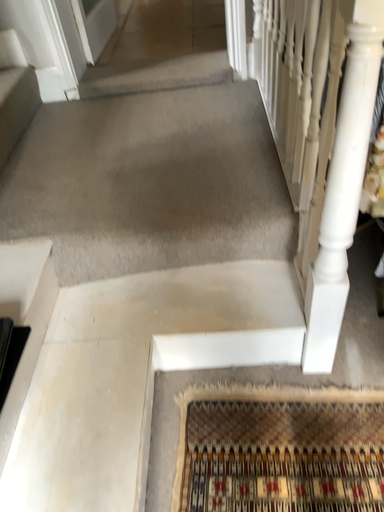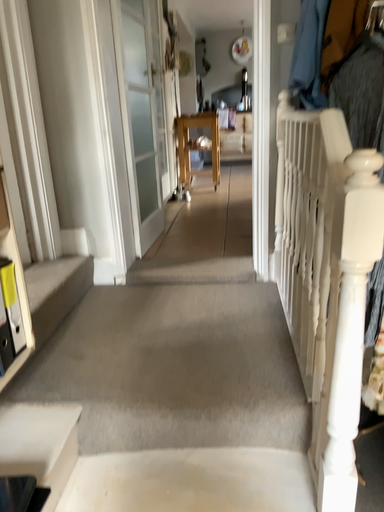
Question: How did the camera likely rotate when shooting the video?

Choices:
 (A) rotated upward
 (B) rotated downward

Answer: (A)